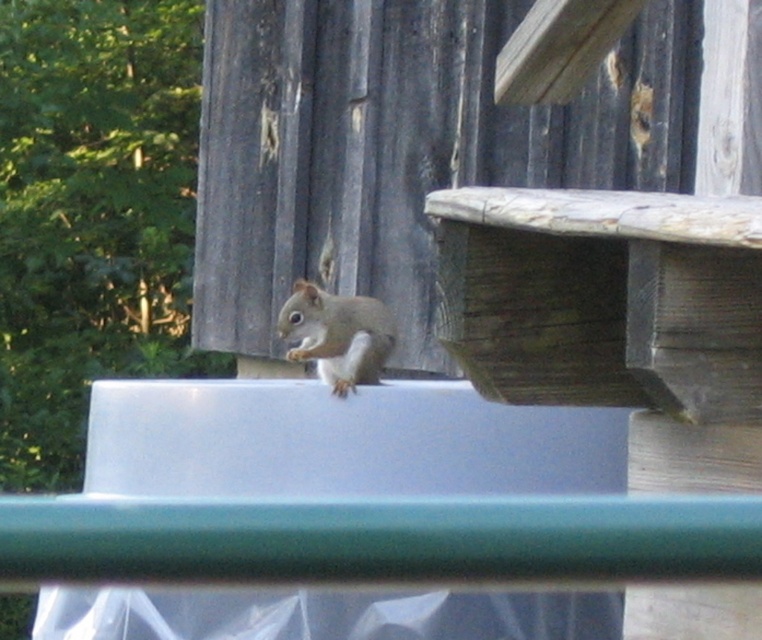
Please describe the location of the point at coordinates (341,442) in relation to the squirrel and the wooden deck structure in the image.

The point at coordinates (341,442) is located on the smooth plastic tray at upper center, which is above the squirrel and in front of the wooden deck structure.

What is the exact position of the smooth plastic tray at upper center in the image?

The smooth plastic tray at upper center is located at point coordinates of (x=341, y=442).